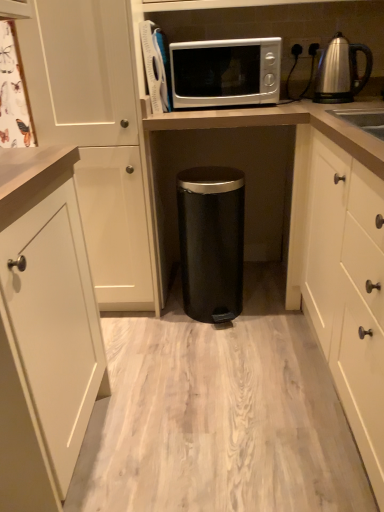
Question: Visually, is satin silver microwave at upper center positioned to the left or to the right of white matte cabinet at right, which appears as the first cabinetry when viewed from the right?

Choices:
 (A) left
 (B) right

Answer: (A)

Question: Considering the positions of satin silver microwave at upper center and white matte cabinet at right, acting as the 2th cabinetry starting from the left, in the image, is satin silver microwave at upper center wider or thinner than white matte cabinet at right, acting as the 2th cabinetry starting from the left,?

Choices:
 (A) thin
 (B) wide

Answer: (A)

Question: Considering the real-world distances, which object is closest to the white matte cabinet at left, marked as the 2th cabinetry in a right-to-left arrangement?

Choices:
 (A) satin silver kettle at upper right
 (B) satin silver microwave at upper center, the 2th appliance from the right
 (C) black matte trash can at center, which is counted as the second appliance, starting from the top
 (D) white matte cabinet at right, acting as the 2th cabinetry starting from the left
 (E) satin silver microwave at upper center

Answer: (B)

Question: Which object is positioned farthest from the satin silver microwave at upper center?

Choices:
 (A) white matte cabinet at right, which appears as the first cabinetry when viewed from the right
 (B) satin silver microwave at upper center, the 2th appliance from the right
 (C) white matte cabinet at left, the first cabinetry in the left-to-right sequence
 (D) satin silver kettle at upper right
 (E) black matte trash can at center, which is the 1th appliance in bottom-to-top order

Answer: (A)